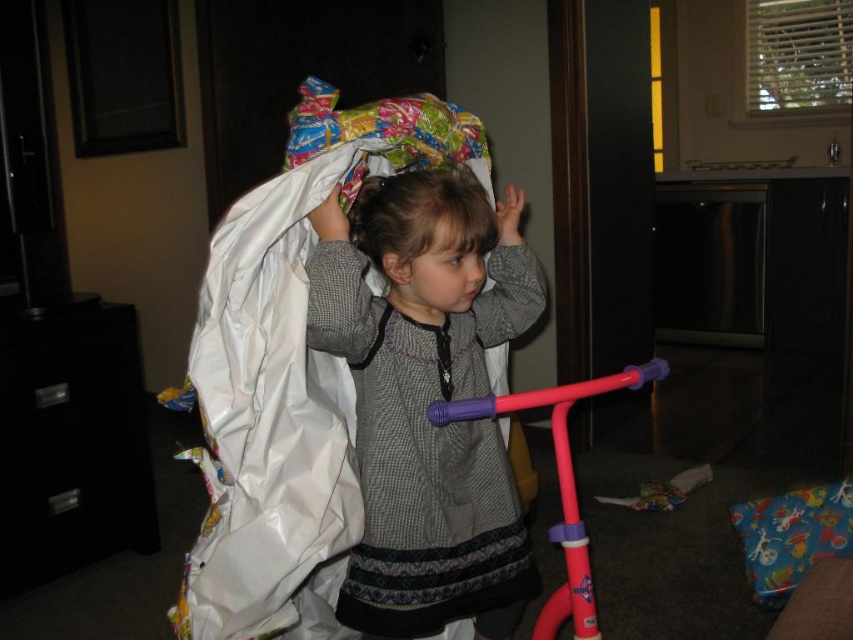
Is point (413, 292) closer to camera compared to point (403, 212)?

No, it is behind (403, 212).

Which is more to the left, matte gray sweater at center or smooth gray sweater at center?

smooth gray sweater at center is more to the left.

Find the location of `matte gray sweater at center`. matte gray sweater at center is located at coordinates pyautogui.click(x=427, y=397).